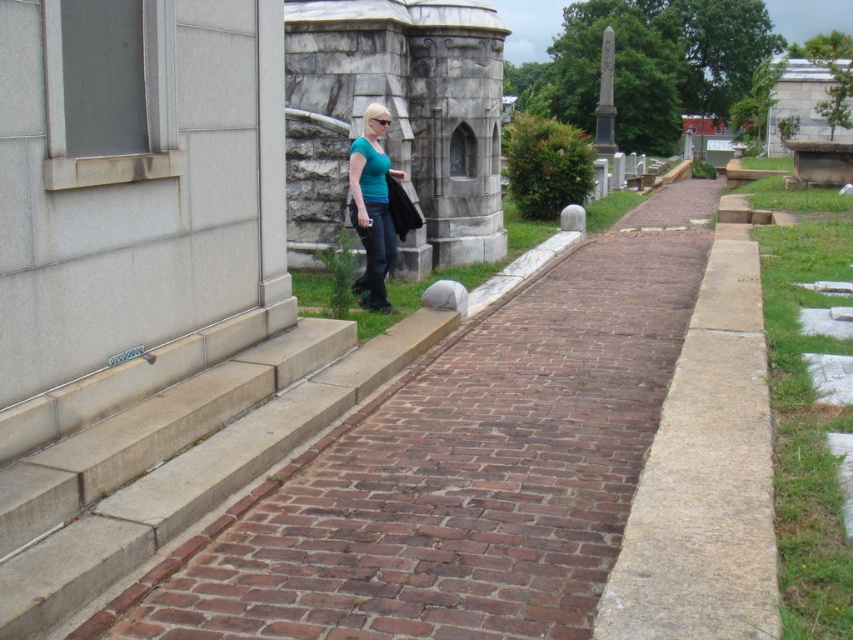
Is point (532, 636) positioned in front of point (602, 138)?

Yes.

Who is lower down, brick pavement at center or black marble obelisk at upper right?

brick pavement at center is below.

Find the location of a particular element. The width and height of the screenshot is (853, 640). brick pavement at center is located at coordinates (465, 470).

Based on the photo, who is positioned more to the left, brick pavement at center or matte teal shirt at center?

Positioned to the left is matte teal shirt at center.

Locate an element on the screen. The width and height of the screenshot is (853, 640). brick pavement at center is located at coordinates (465, 470).

Can you confirm if matte teal shirt at center is thinner than black marble obelisk at upper right?

Yes.

Who is positioned more to the right, matte teal shirt at center or black marble obelisk at upper right?

black marble obelisk at upper right is more to the right.

Is point (380, 282) positioned behind point (612, 88)?

No, it is in front of (612, 88).

At what (x,y) coordinates should I click in order to perform the action: click on matte teal shirt at center. Please return your answer as a coordinate pair (x, y). The height and width of the screenshot is (640, 853). Looking at the image, I should click on (372, 205).